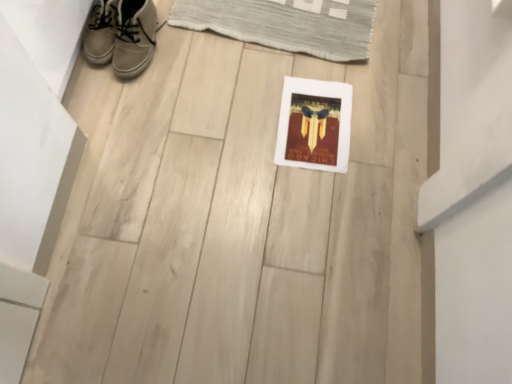
You are a GUI agent. You are given a task and a screenshot of the screen. Output one action in this format:
    pyautogui.click(x=<x>, y=<y>)
    Task: Click on the vacant space situated above white matte picture frame at center (from a real-world perspective)
    The height and width of the screenshot is (384, 512).
    Given the screenshot: What is the action you would take?
    pyautogui.click(x=312, y=125)